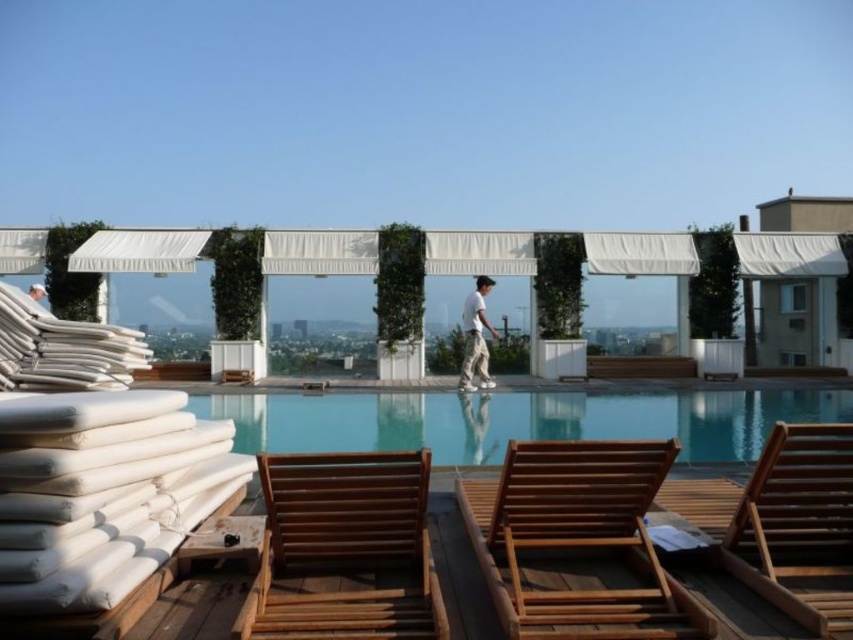
Question: Considering the real-world distances, which object is closest to the white fabric building at upper right?

Choices:
 (A) wooden slats beach chair at center
 (B) clear glass pool at center
 (C) wooden beach chair at center

Answer: (B)

Question: Does clear glass pool at center lie in front of wooden slats beach chair at center?

Choices:
 (A) no
 (B) yes

Answer: (A)

Question: Which point is closer to the camera?

Choices:
 (A) (421, 632)
 (B) (712, 493)
 (C) (471, 317)
 (D) (457, 500)

Answer: (A)

Question: Does wooden lounge chair at center have a smaller size compared to white fabric building at upper right?

Choices:
 (A) yes
 (B) no

Answer: (A)

Question: Is clear glass pool at center above white fabric building at upper right?

Choices:
 (A) no
 (B) yes

Answer: (A)

Question: Which point is closer to the camera?

Choices:
 (A) (767, 410)
 (B) (672, 508)

Answer: (B)